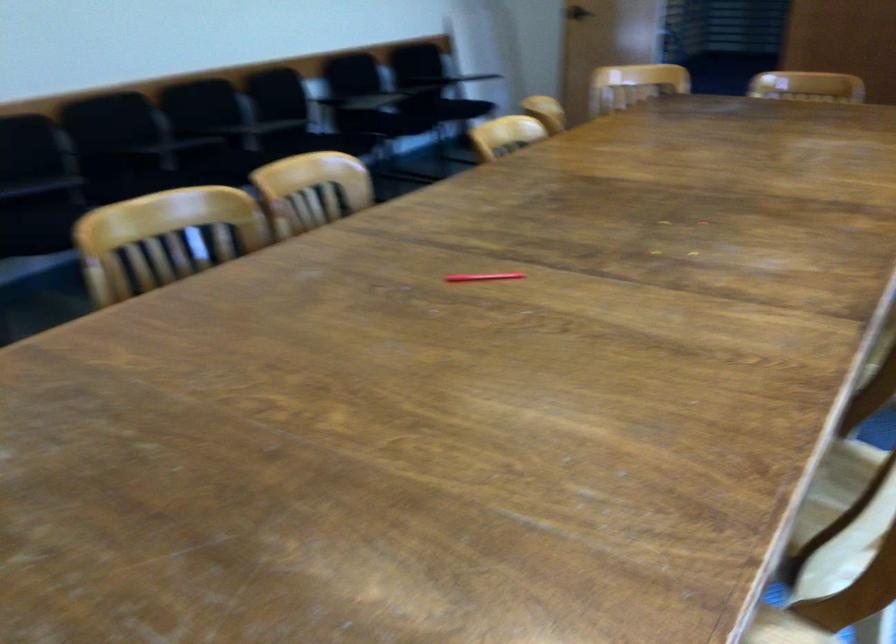
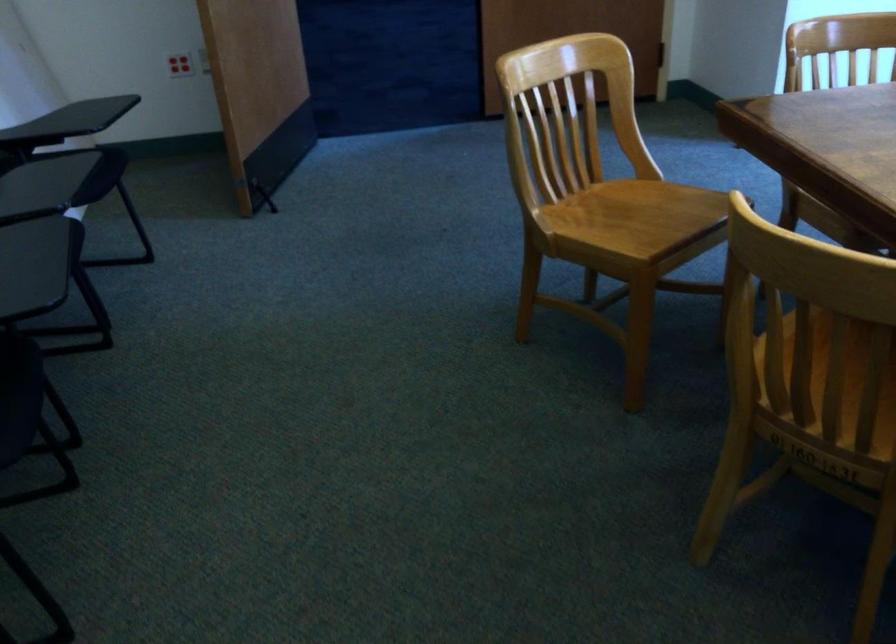
Question: I am providing you with two images of the same scene from different viewpoints. After the viewpoint changes to image2, which objects are now occluded?

Choices:
 (A) red wall outlet
 (B) wooden chair sitting surface
 (C) yellow feather duster
 (D) black chair sitting surface

Answer: (D)